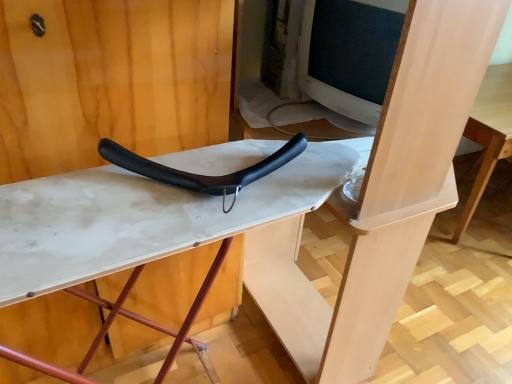
The image size is (512, 384). I want to click on black matte handle at center, so click(x=202, y=175).

What do you see at coordinates (202, 175) in the screenshot? I see `black matte handle at center` at bounding box center [202, 175].

Image resolution: width=512 pixels, height=384 pixels. What do you see at coordinates (142, 222) in the screenshot?
I see `white matte ironing board at center` at bounding box center [142, 222].

The height and width of the screenshot is (384, 512). What are the coordinates of `white matte ironing board at center` in the screenshot? It's located at (142, 222).

The image size is (512, 384). What are the coordinates of `black matte handle at center` in the screenshot? It's located at (202, 175).

Visually, is white matte ironing board at center positioned to the left or to the right of black matte handle at center?

In the image, white matte ironing board at center appears on the left side of black matte handle at center.

Considering the relative positions of white matte ironing board at center and black matte handle at center in the image provided, is white matte ironing board at center in front of black matte handle at center?

Yes, white matte ironing board at center is closer to the camera.

Which point is more forward, [28,264] or [244,170]?

The point [28,264] is closer.

From the picture: From the image's perspective, is white matte ironing board at center above or below black matte handle at center?

From the image's perspective, white matte ironing board at center appears below black matte handle at center.

From a real-world perspective, is white matte ironing board at center physically above black matte handle at center?

Actually, white matte ironing board at center is physically below black matte handle at center in the real world.

Is white matte ironing board at center wider or thinner than black matte handle at center?

In the image, white matte ironing board at center appears to be wider than black matte handle at center.

Can you confirm if white matte ironing board at center is taller than black matte handle at center?

Yes, white matte ironing board at center is taller than black matte handle at center.

Does white matte ironing board at center have a larger size compared to black matte handle at center?

Correct, white matte ironing board at center is larger in size than black matte handle at center.

Can we say white matte ironing board at center lies outside black matte handle at center?

Yes, white matte ironing board at center is outside of black matte handle at center.

In the scene shown: Is white matte ironing board at center not near black matte handle at center?

Actually, white matte ironing board at center and black matte handle at center are a little close together.

Is white matte ironing board at center facing towards black matte handle at center?

No.

Locate an element on the screen. table below the black matte handle at center (from a real-world perspective) is located at coordinates (142, 222).

Can you confirm if black matte handle at center is positioned to the right of white matte ironing board at center?

Yes, black matte handle at center is to the right of white matte ironing board at center.

Relative to white matte ironing board at center, is black matte handle at center in front or behind?

In the image, black matte handle at center appears behind white matte ironing board at center.

Which point is more distant from viewer, (231, 189) or (310, 175)?

Positioned behind is point (310, 175).

From the image's perspective, which object appears higher, black matte handle at center or white matte ironing board at center?

black matte handle at center appears higher in the image.

From a real-world perspective, between black matte handle at center and white matte ironing board at center, who is vertically lower?

white matte ironing board at center is physically lower.

Between black matte handle at center and white matte ironing board at center, which one has larger width?

Wider between the two is white matte ironing board at center.

Considering the sizes of black matte handle at center and white matte ironing board at center in the image, is black matte handle at center taller or shorter than white matte ironing board at center?

In the image, black matte handle at center appears to be shorter than white matte ironing board at center.

Can you confirm if black matte handle at center is bigger than white matte ironing board at center?

Actually, black matte handle at center might be smaller than white matte ironing board at center.

Is white matte ironing board at center surrounded by black matte handle at center?

Definitely not — white matte ironing board at center is not inside black matte handle at center.

Is black matte handle at center touching white matte ironing board at center?

Yes, the surface of black matte handle at center is in contact with white matte ironing board at center.

Could you tell me if black matte handle at center is turned towards white matte ironing board at center?

No, black matte handle at center is not facing towards white matte ironing board at center.

Where is `handle on the right of the white matte ironing board at center`? handle on the right of the white matte ironing board at center is located at coordinates (202, 175).

Where is `handle that appears above the white matte ironing board at center (from a real-world perspective)`? handle that appears above the white matte ironing board at center (from a real-world perspective) is located at coordinates (202, 175).

The image size is (512, 384). What are the coordinates of `table located on the left of black matte handle at center` in the screenshot? It's located at (142, 222).